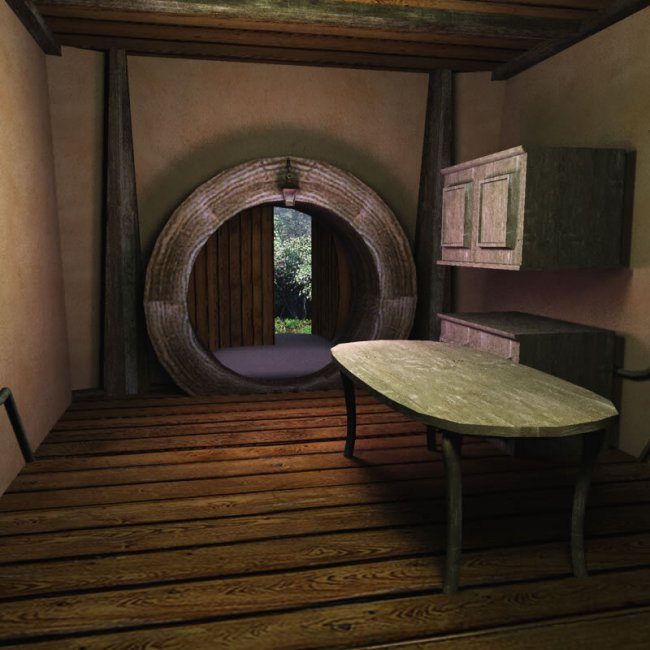
The image size is (650, 650). What are the coordinates of `cabinets` in the screenshot? It's located at (497, 214), (448, 205).